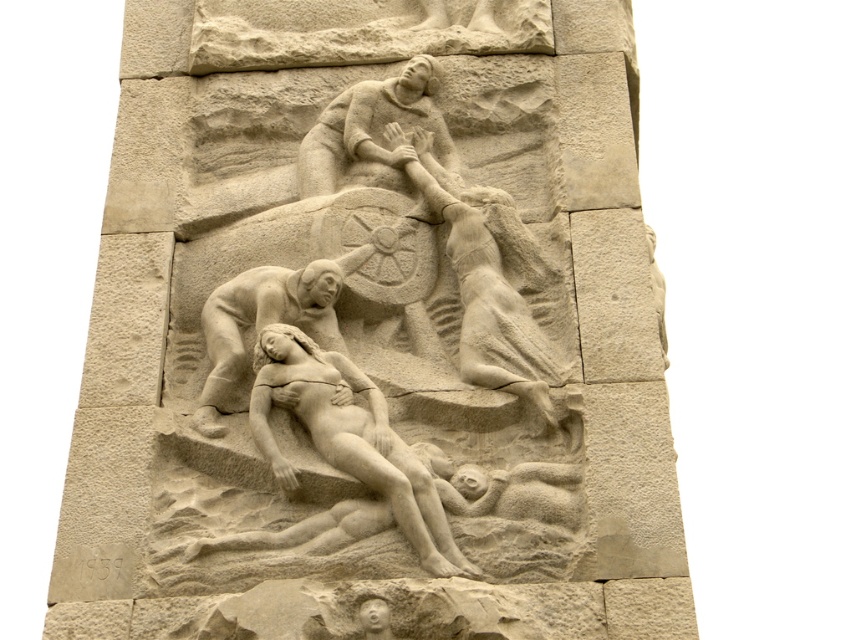
Question: Can you confirm if smooth stone warrior at center is smaller than smooth beige reclining figure at center?

Choices:
 (A) yes
 (B) no

Answer: (B)

Question: Can you confirm if smooth stone warrior at center is positioned above smooth stone reclining figure at lower center?

Choices:
 (A) yes
 (B) no

Answer: (A)

Question: Which point is closer to the camera?

Choices:
 (A) (210, 396)
 (B) (507, 314)
 (C) (419, 506)

Answer: (C)

Question: Which is farther from the smooth beige reclining figure at center?

Choices:
 (A) smooth stone reclining figure at lower center
 (B) smooth stone warrior at center

Answer: (B)

Question: Which of the following is the farthest from the observer?

Choices:
 (A) smooth stone reclining figure at lower center
 (B) smooth beige reclining figure at center
 (C) smooth stone warrior at center

Answer: (B)

Question: Is smooth stone reclining figure at lower center below smooth beige reclining figure at center?

Choices:
 (A) no
 (B) yes

Answer: (B)